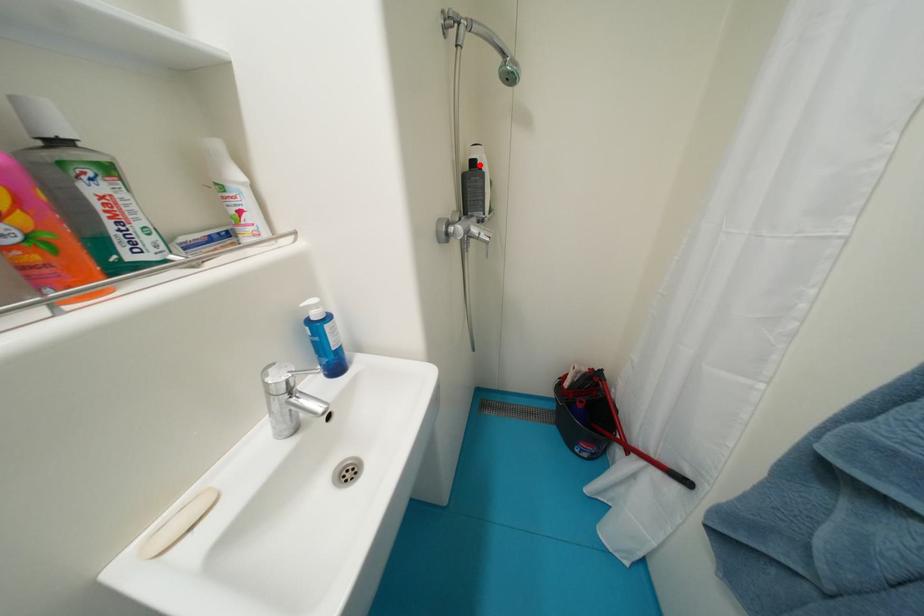
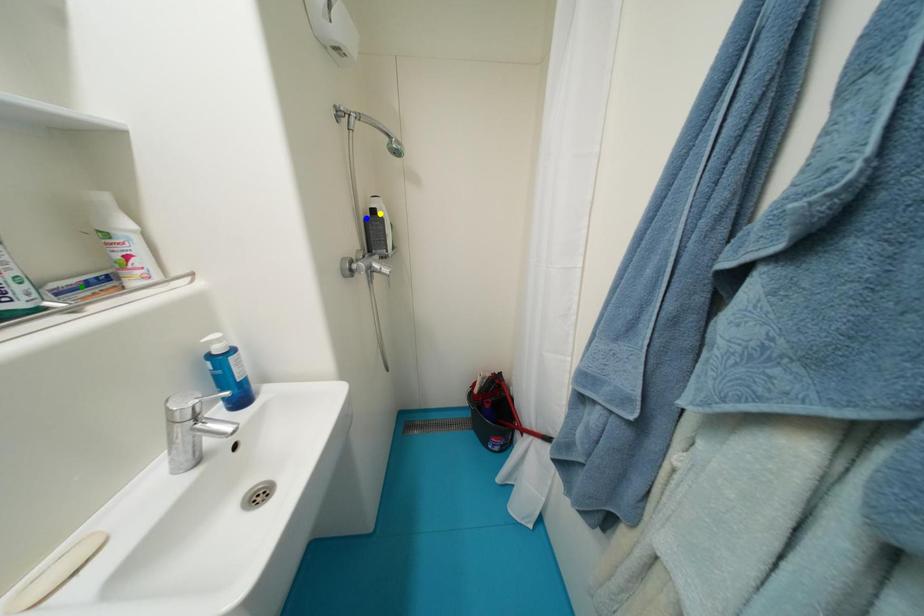
Question: I am providing you with two images of the same scene from different viewpoints. A red point is marked on the first image. You are given multiple points on the second image. Which mark in image 2 goes with the point in image 1?

Choices:
 (A) green point
 (B) yellow point
 (C) blue point

Answer: (B)